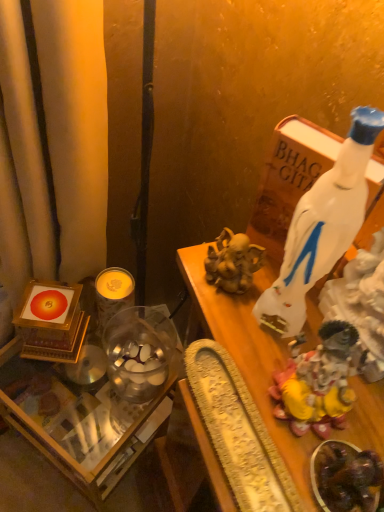
At what (x,y) coordinates should I click in order to perform the action: click on vacant space in front of yellow wax candle at center left. Please return your answer as a coordinate pair (x, y). The image size is (384, 512). Looking at the image, I should click on (82, 404).